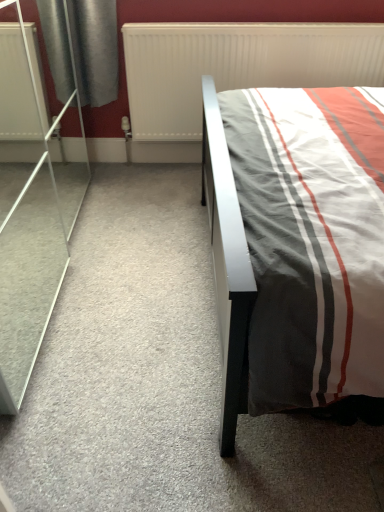
Where is `vacant area located to the right-hand side of transparent glass screen door at left`? The height and width of the screenshot is (512, 384). vacant area located to the right-hand side of transparent glass screen door at left is located at coordinates (150, 288).